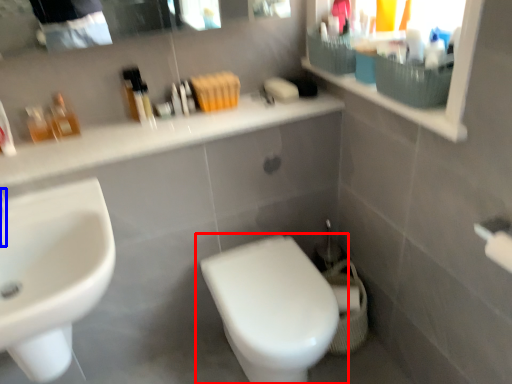
Question: Which of the following is the closest to the observer, toilet (highlighted by a red box) or faucet (highlighted by a blue box)?

Choices:
 (A) toilet
 (B) faucet

Answer: (B)